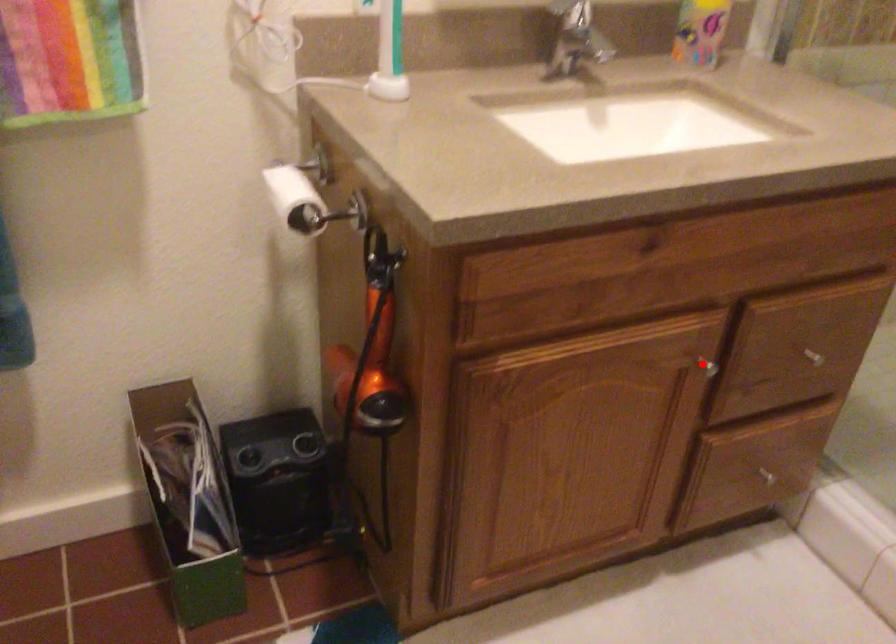
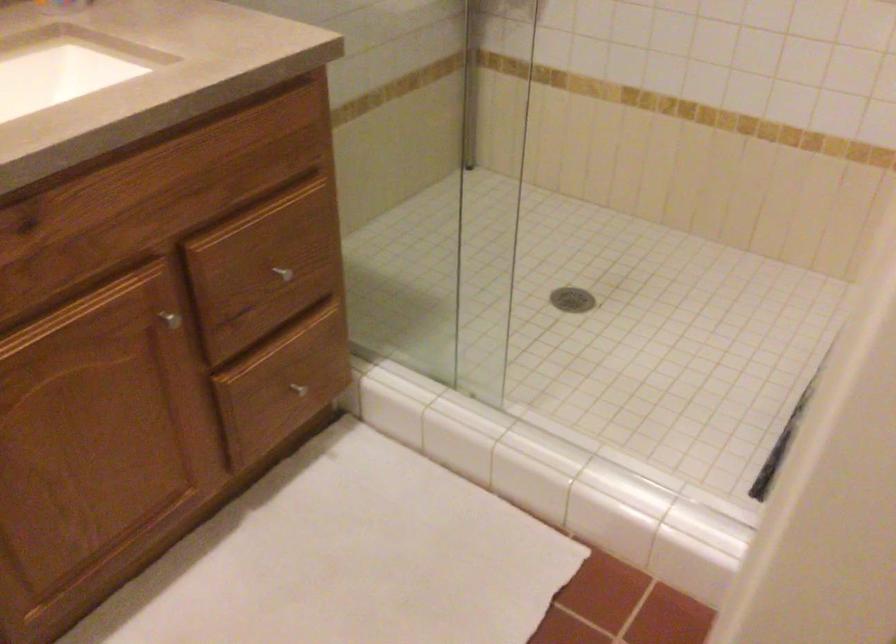
Locate, in the second image, the point that corresponds to the highlighted location in the first image.

(169, 319)